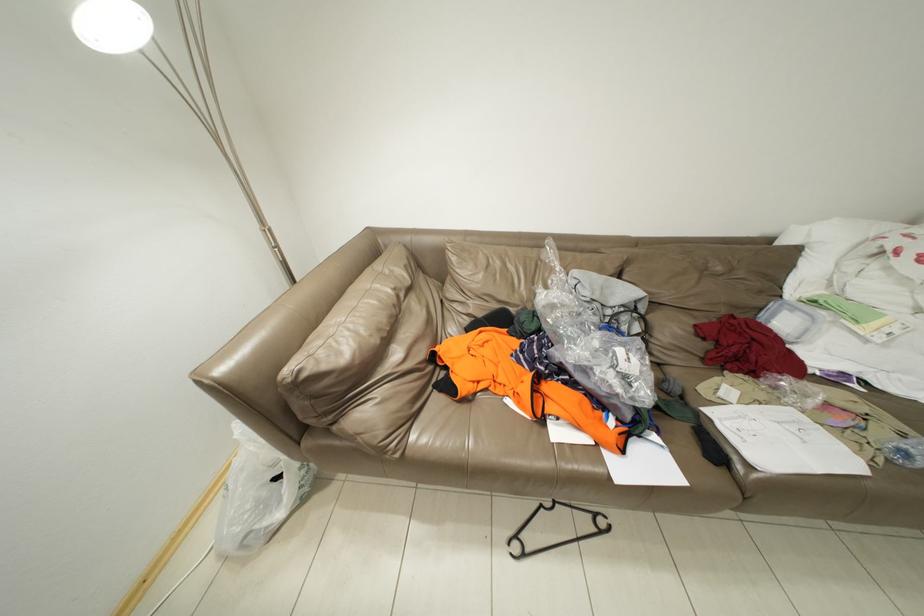
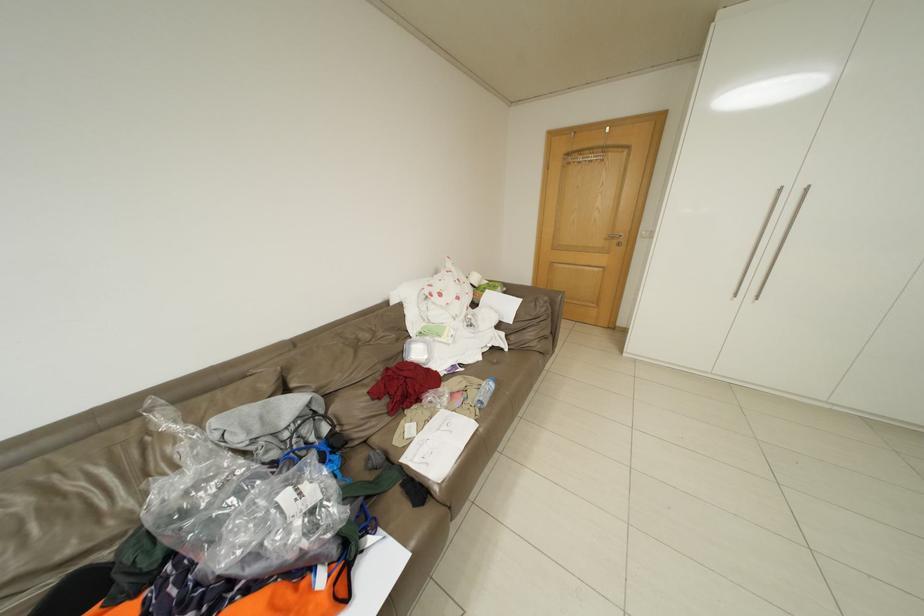
Question: The camera is either moving clockwise (left) or counter-clockwise (right) around the object. The first image is from the beginning of the video and the second image is from the end. Is the camera moving left or right when shooting the video?

Choices:
 (A) Left
 (B) Right

Answer: (A)